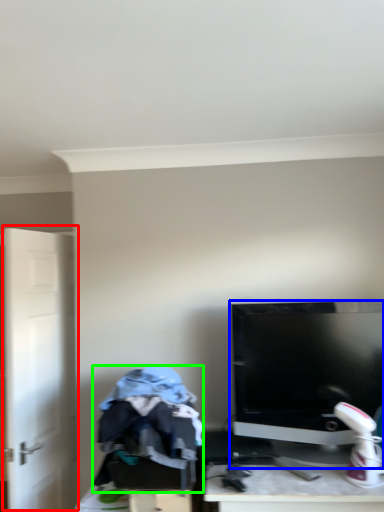
Question: Estimate the real-world distances between objects in this image. Which object is farther from door (highlighted by a red box), computer monitor (highlighted by a blue box) or clothing (highlighted by a green box)?

Choices:
 (A) computer monitor
 (B) clothing

Answer: (A)